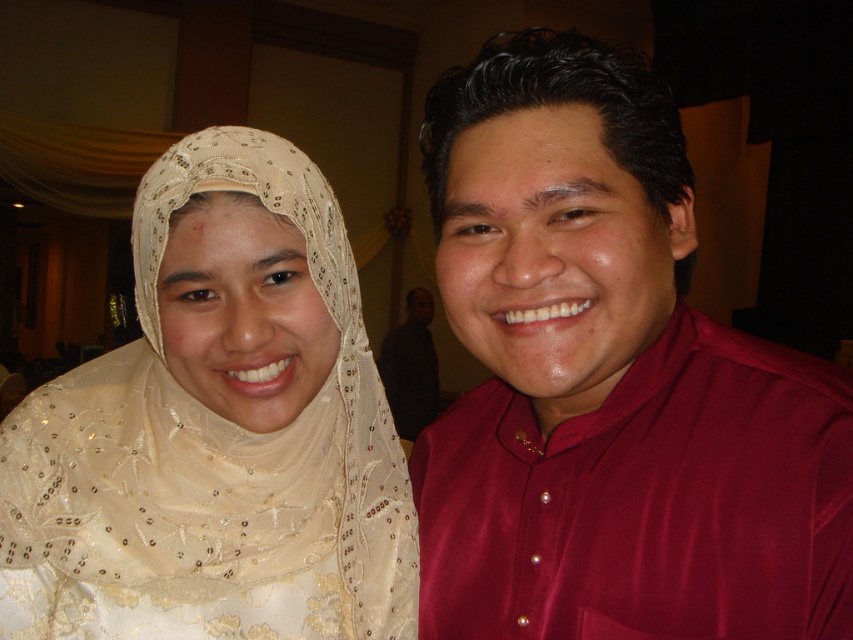
You are taking a photo and want to place a decorative sticker at point (x=216, y=429). The sticker has a glossy finish. Will the sticker stand out against the surface it will be placed on?

The point (x=216, y=429) is on matte beige veil at upper left. Since the matte surface does not reflect light like a glossy one, the glossy sticker will stand out against the matte beige veil at upper left.

Consider the image. You are a photographer standing at the position of the camera. You want to adjust the focus so that both the maroon satin shirt at right and the dark brown shirt at center are in sharp focus. The depth of field you can achieve is 4 meters. Can you capture both shirts in focus without changing your position?

The maroon satin shirt at right is 4.23 meters away from the dark brown shirt at center. Since the distance between them is slightly more than 4 meters, adjusting the focus to include both might be challenging. However, if the depth of field is precisely managed, it could potentially capture both, but there might be a slight blur on one of the shirts.